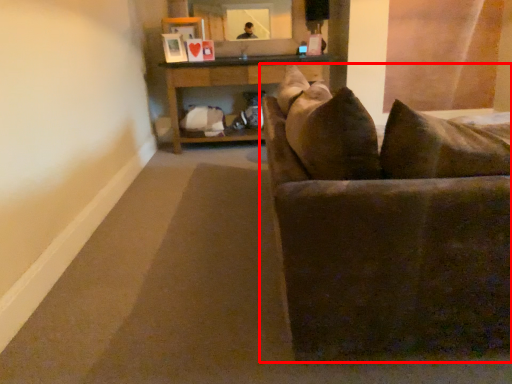
Question: From the image's perspective, considering the relative positions of studio couch (annotated by the red box) and table in the image provided, where is studio couch (annotated by the red box) located with respect to the staircase?

Choices:
 (A) below
 (B) above

Answer: (A)